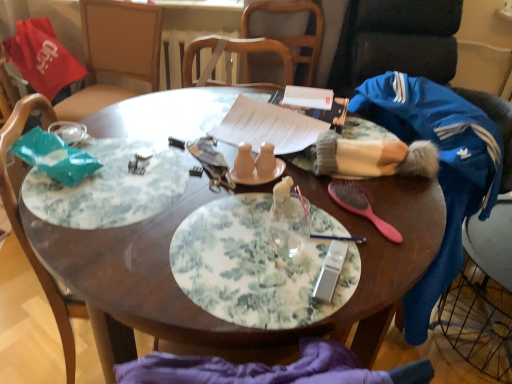
You are a GUI agent. You are given a task and a screenshot of the screen. Output one action in this format:
    pyautogui.click(x=<x>, y=<y>)
    Task: Click on the vacant space in front of pink plastic hairbrush at center-right, the first tableware positioned from the right
    
    Given the screenshot: What is the action you would take?
    pyautogui.click(x=388, y=254)